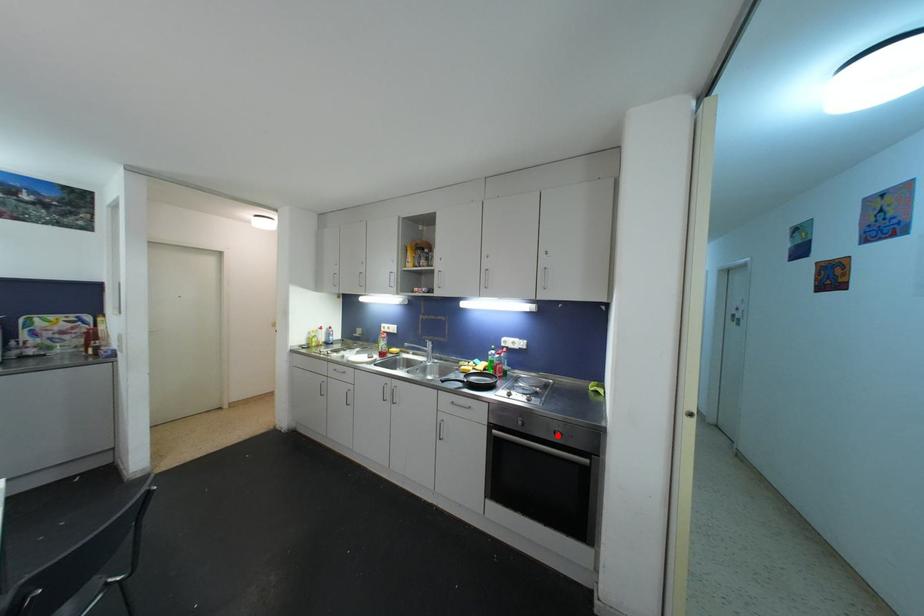
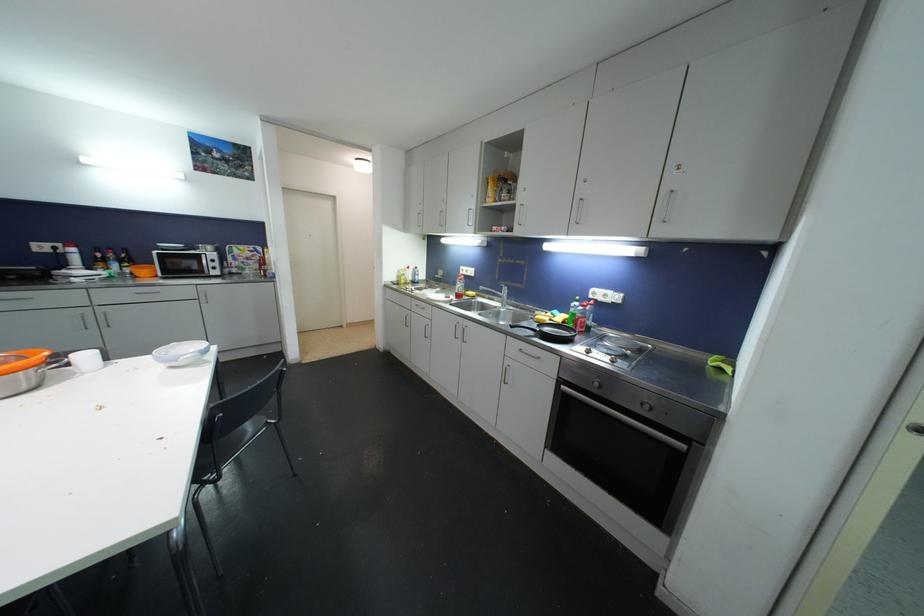
Question: I am providing you with two images of the same scene from different viewpoints. In image1, a red point is highlighted. Considering the same 3D point in image2, which of the following is correct?

Choices:
 (A) It is closer
 (B) It is farther

Answer: (A)